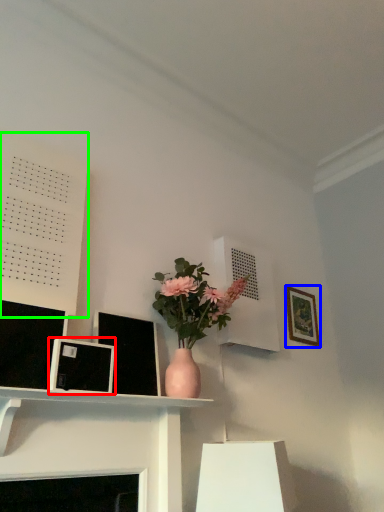
Question: Which object is positioned closest to picture frame (highlighted by a red box)? Select from picture frame (highlighted by a blue box) and bulletin board (highlighted by a green box).

Choices:
 (A) picture frame
 (B) bulletin board

Answer: (B)